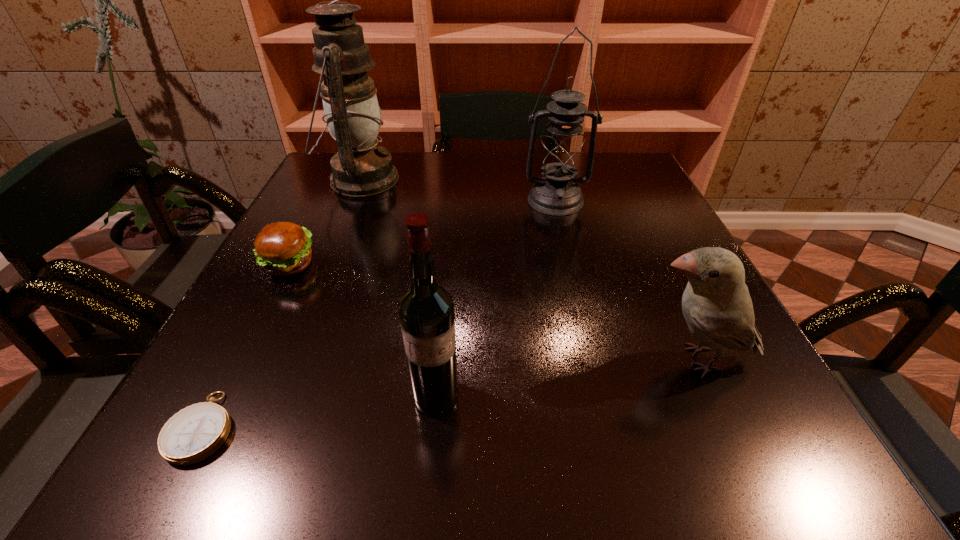
The width and height of the screenshot is (960, 540). I want to click on object present at the right edge, so click(716, 304).

Identify the location of object that is at the far left corner. (353, 117).

Locate an element on the screen. The height and width of the screenshot is (540, 960). object that is at the near left corner is located at coordinates (193, 434).

In the image, there is a desktop. Where is `vacant space at the far edge`? vacant space at the far edge is located at coordinates (501, 174).

Where is `free space at the near edge of the desktop`? The image size is (960, 540). free space at the near edge of the desktop is located at coordinates (599, 441).

I want to click on blank space at the left edge of the desktop, so click(x=246, y=292).

Find the location of a particular element. vacant point at the right edge is located at coordinates (634, 235).

Find the location of a particular element. Image resolution: width=960 pixels, height=540 pixels. blank area at the far left corner is located at coordinates (332, 151).

Locate an element on the screen. The height and width of the screenshot is (540, 960). free area in between the right oil lamp and the bird is located at coordinates (626, 280).

At what (x,y) coordinates should I click in order to perform the action: click on vacant area between the left oil lamp and the fourth shortest object. Please return your answer as a coordinate pair (x, y). Looking at the image, I should click on (398, 288).